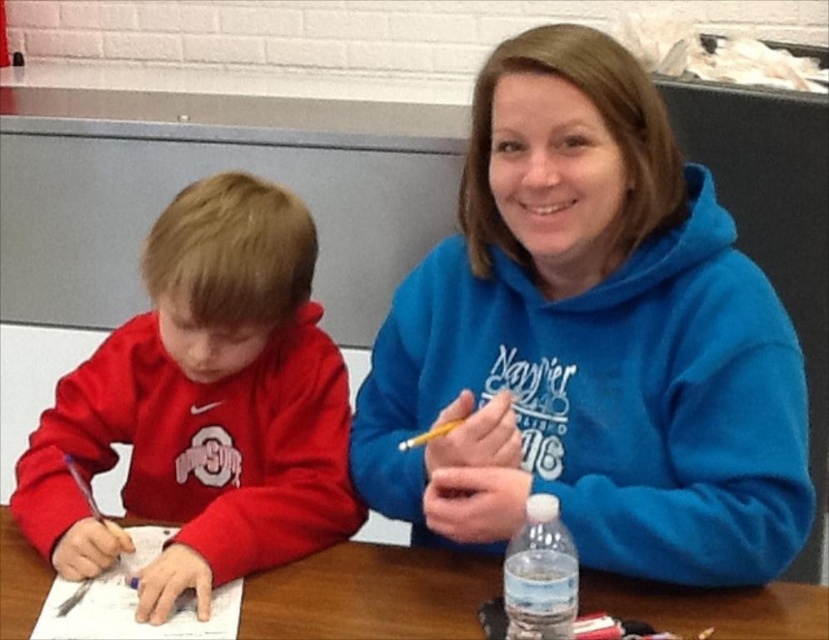
You are a photographer standing in front of the table where the blue fleece hoodie at upper right and the matte red sweatshirt at left are located. You need to place a 15 cm wide decorative plate between them. Can the space between the two items accommodate the plate?

The blue fleece hoodie at upper right is wider than the matte red sweatshirt at left. However, the exact distance between them isn not specified in the provided description. Without knowing the distance between the two items, it is impossible to determine if the 15 cm wide decorative plate will fit.

You are a photographer trying to capture a closeup of the matte red sweatshirt at left. The camera you are using has a focal length of 50mm and you are currently positioned at point (202,406). To get a clear shot, you need to adjust your position so that the sweatshirt fills the frame without any distortion. Based on the scene description and the object details provided, what adjustment should you make to your current position?

The point (202,406) is where the matte red sweatshirt at left is located. To capture a closeup without distortion, you should move closer to the sweatshirt while keeping the camera focused on that point.

From the picture: You are standing in front of the image and want to locate the matte red sweatshirt at left. What are its coordinates?

The coordinates of the matte red sweatshirt at left are at point (202, 406).